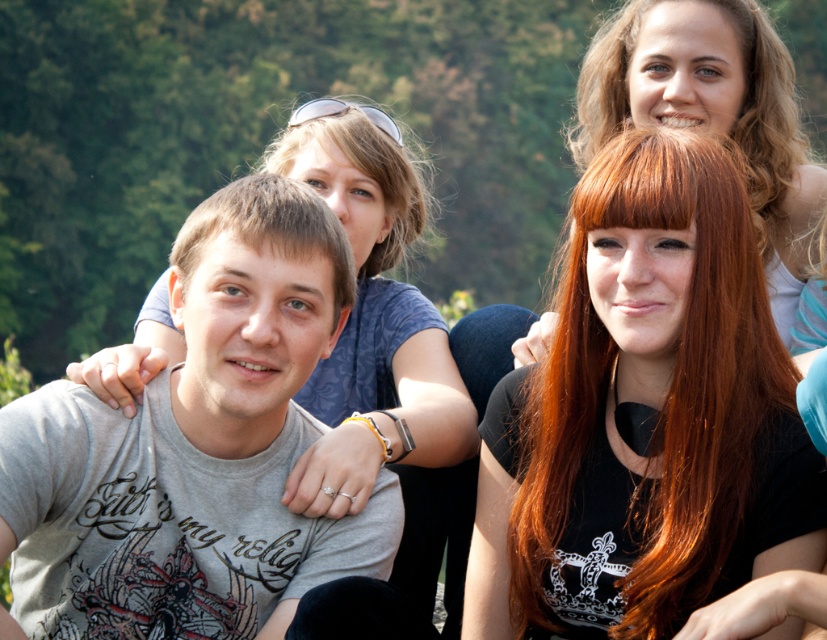
Question: Which point appears farthest from the camera in this image?

Choices:
 (A) (299, 556)
 (B) (617, 99)
 (C) (238, 189)

Answer: (B)

Question: Which of the following is the farthest from the observer?

Choices:
 (A) curly blonde hair at upper right
 (B) brown matte hair at center

Answer: (A)

Question: Is shiny red hair at center smaller than brown matte hair at center?

Choices:
 (A) no
 (B) yes

Answer: (A)

Question: Is shiny red hair at center bigger than brown matte hair at center?

Choices:
 (A) no
 (B) yes

Answer: (B)

Question: Is the position of shiny red hair at center less distant than that of brown matte hair at center?

Choices:
 (A) yes
 (B) no

Answer: (A)

Question: Which object is farther from the camera taking this photo?

Choices:
 (A) curly blonde hair at upper right
 (B) shiny red hair at center
 (C) gray cotton t-shirt at left

Answer: (A)